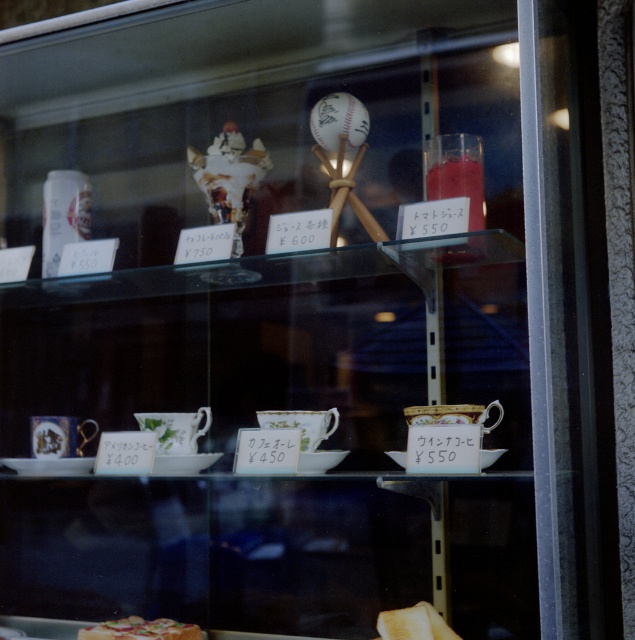
Question: Among these objects, which one is farthest from the camera?

Choices:
 (A) shiny plastic pizza at lower center
 (B) golden toasted bread at lower center
 (C) white porcelain saucer at lower center

Answer: (A)

Question: Can you confirm if shiny plastic pizza at lower center is wider than golden toasted bread at lower center?

Choices:
 (A) no
 (B) yes

Answer: (B)

Question: Is shiny plastic pizza at lower center wider than golden toasted bread at lower center?

Choices:
 (A) yes
 (B) no

Answer: (A)

Question: Can you confirm if shiny plastic pizza at lower center is smaller than white porcelain saucer at lower center?

Choices:
 (A) yes
 (B) no

Answer: (A)

Question: Which object is closer to the camera taking this photo?

Choices:
 (A) shiny plastic pizza at lower center
 (B) golden toasted bread at lower center
 (C) white porcelain saucer at lower center

Answer: (C)

Question: Which object is positioned closest to the white porcelain saucer at lower center?

Choices:
 (A) shiny plastic pizza at lower center
 (B) golden toasted bread at lower center

Answer: (B)